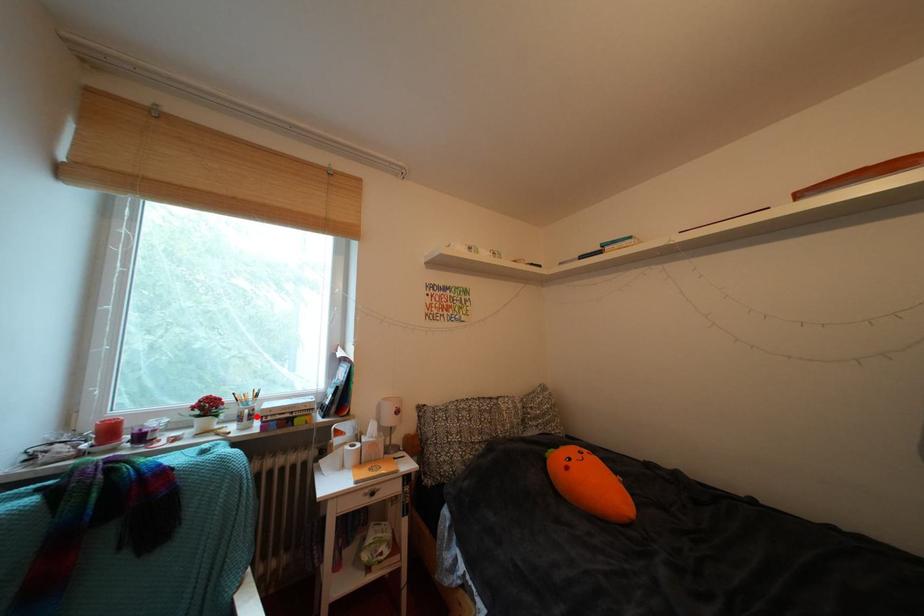
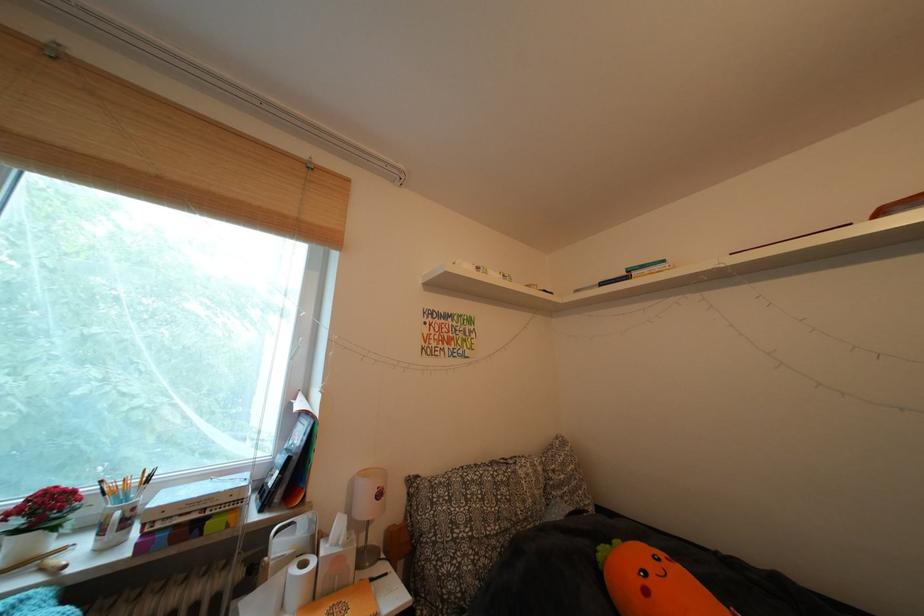
Find the pixel in the second image that matches the highlighted location in the first image.

(128, 519)